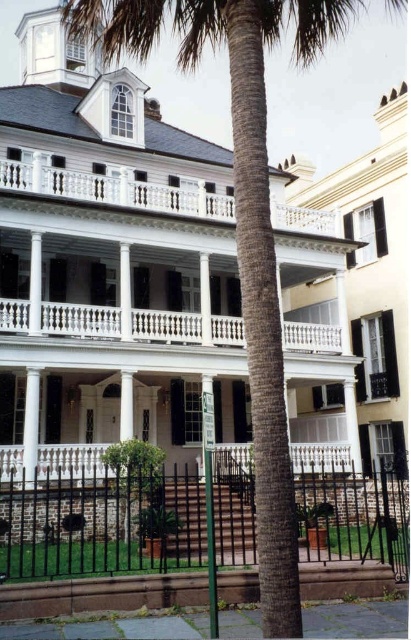
Describe the element at coordinates (99, 524) in the screenshot. I see `black wrought iron fence at lower center` at that location.

Is black wrought iron fence at lower center positioned in front of white glossy column at center?

That is True.

Is point (117, 492) positioned in front of point (30, 442)?

Yes, it is in front of point (30, 442).

The width and height of the screenshot is (411, 640). What are the coordinates of `black wrought iron fence at lower center` in the screenshot? It's located at (99, 524).

This screenshot has height=640, width=411. Identify the location of white wood porch at upper center. (115, 189).

Does white wood porch at upper center appear under white glossy column at center?

Actually, white wood porch at upper center is above white glossy column at center.

Between point (57, 179) and point (32, 416), which one is positioned in front?

Point (32, 416)

This screenshot has height=640, width=411. Find the location of `white wood porch at upper center`. white wood porch at upper center is located at coordinates (115, 189).

Is white balustrade at center shorter than white glossy column at center?

Correct, white balustrade at center is not as tall as white glossy column at center.

The image size is (411, 640). I want to click on white balustrade at center, so click(x=80, y=321).

The image size is (411, 640). Identify the location of white balustrade at center. (80, 321).